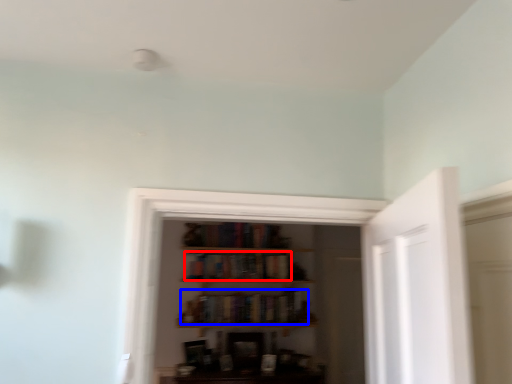
Question: Which object is closer to the camera taking this photo, book (highlighted by a red box) or book (highlighted by a blue box)?

Choices:
 (A) book
 (B) book

Answer: (B)